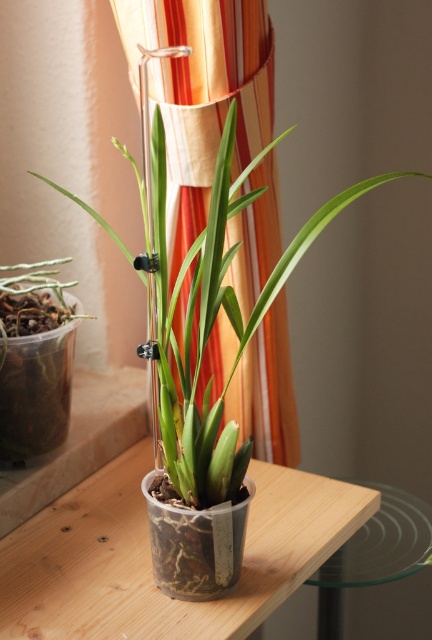
Is green matte plant at center below transparent glass table at lower right?

Actually, green matte plant at center is above transparent glass table at lower right.

Measure the distance from green matte plant at center to transparent glass table at lower right.

green matte plant at center is 19.78 inches away from transparent glass table at lower right.

Does point (177, 420) come farther from viewer compared to point (416, 502)?

No, it is in front of (416, 502).

You are a GUI agent. You are given a task and a screenshot of the screen. Output one action in this format:
    pyautogui.click(x=<x>, y=<y>)
    Task: Click on the green matte plant at center
    This screenshot has height=640, width=432.
    Given the screenshot: What is the action you would take?
    pyautogui.click(x=212, y=308)

Does orange striped curtain at center have a larger size compared to transparent plastic pot at left?

Yes, orange striped curtain at center is bigger than transparent plastic pot at left.

Which is in front, point (247, 88) or point (18, 344)?

Point (247, 88) is more forward.

Does point (251, 173) come behind point (8, 435)?

Yes, it is.

At what (x,y) coordinates should I click in order to perform the action: click on orange striped curtain at center. Please return your answer as a coordinate pair (x, y). Looking at the image, I should click on [202, 93].

Between wooden table at center and transparent glass table at lower right, which one has less height?

wooden table at center

Identify the location of wooden table at center. (149, 557).

The width and height of the screenshot is (432, 640). Find the location of `wooden table at center`. wooden table at center is located at coordinates (149, 557).